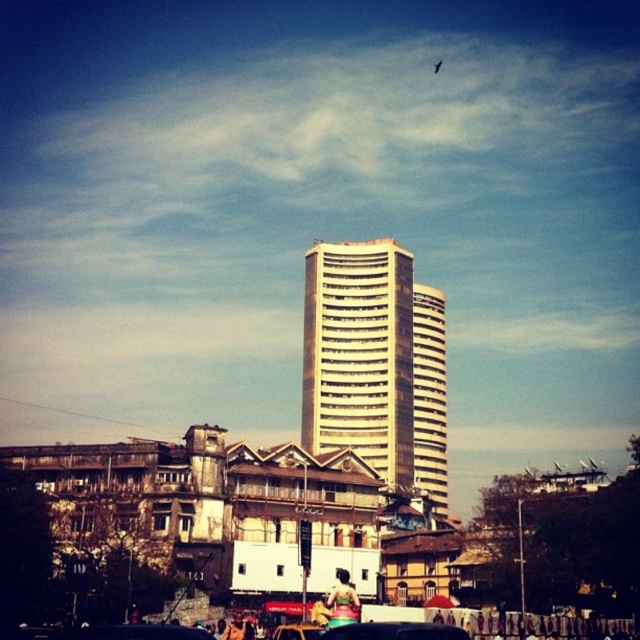
Question: Can you confirm if white glossy building at center is positioned to the right of metallic gold car at center?

Choices:
 (A) yes
 (B) no

Answer: (A)

Question: Which of the following is the closest to the observer?

Choices:
 (A) metallic gold car at center
 (B) metallic silver car at center
 (C) white glossy building at center

Answer: (B)

Question: Can you confirm if white glossy building at center is positioned above metallic silver car at center?

Choices:
 (A) no
 (B) yes

Answer: (B)

Question: Does white glossy building at center appear on the left side of metallic silver car at center?

Choices:
 (A) no
 (B) yes

Answer: (A)

Question: Which of the following is the farthest from the observer?

Choices:
 (A) metallic gold car at center
 (B) white glossy building at center
 (C) metallic silver car at center

Answer: (B)

Question: Among these points, which one is nearest to the camera?

Choices:
 (A) (320, 627)
 (B) (381, 636)

Answer: (B)